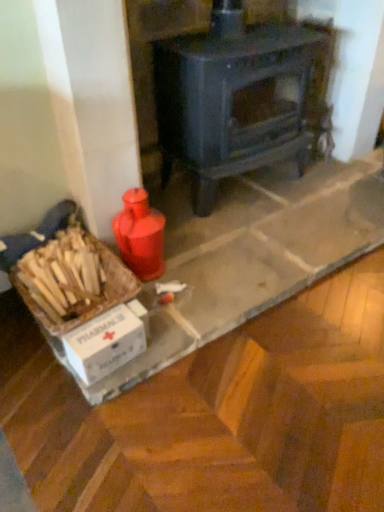
You are a GUI agent. You are given a task and a screenshot of the screen. Output one action in this format:
    pyautogui.click(x=<x>, y=<y>)
    Task: Click on the vacant space in front of matte black wood burning stove at center
    This screenshot has width=384, height=512.
    Given the screenshot: What is the action you would take?
    pyautogui.click(x=254, y=243)